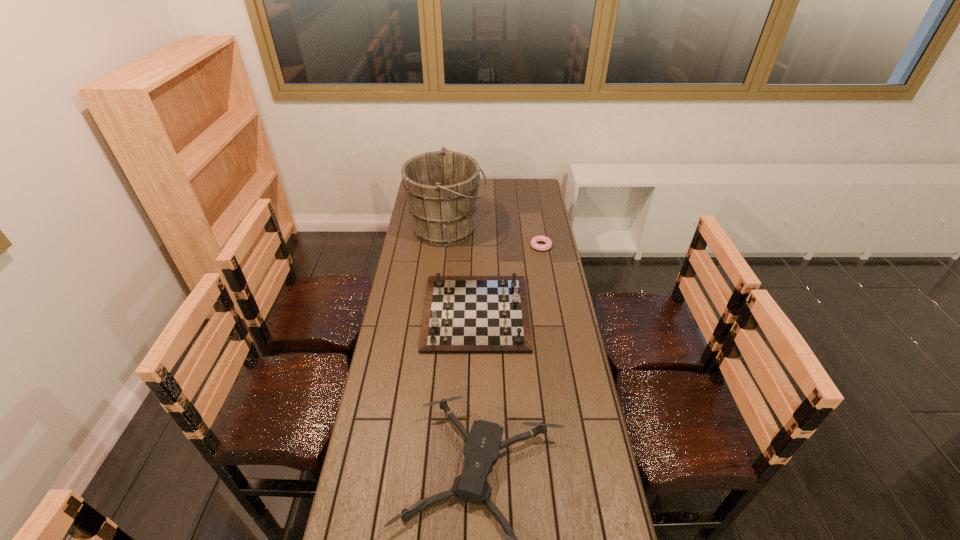
In order to click on free space that satisfies the following two spatial constraints: 1. on the back side of the shortest object; 2. on the handle side of the bucket in this screenshot , I will do `click(538, 228)`.

Locate an element on the screen. This screenshot has height=540, width=960. free spot that satisfies the following two spatial constraints: 1. on the handle side of the bucket; 2. on the left side of the doughnut is located at coordinates (445, 246).

At what (x,y) coordinates should I click in order to perform the action: click on free space that satisfies the following two spatial constraints: 1. on the handle side of the tallest object; 2. on the left side of the doughnut. Please return your answer as a coordinate pair (x, y). Looking at the image, I should click on (445, 246).